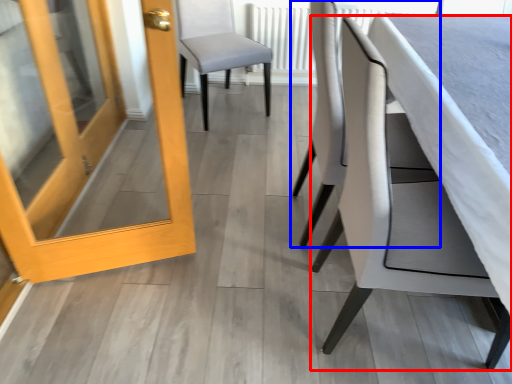
Question: Which point is further to the camera, chair (highlighted by a red box) or chair (highlighted by a blue box)?

Choices:
 (A) chair
 (B) chair

Answer: (B)